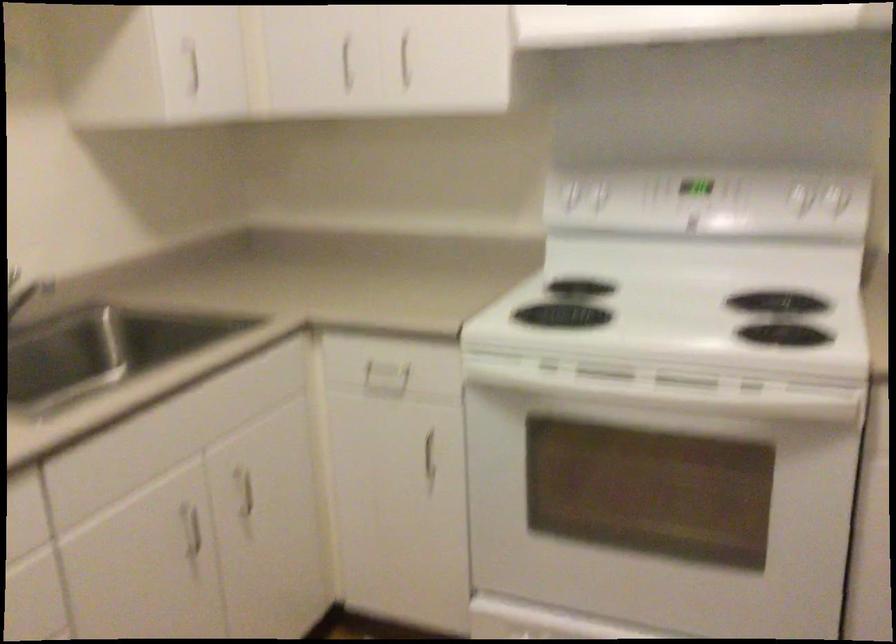
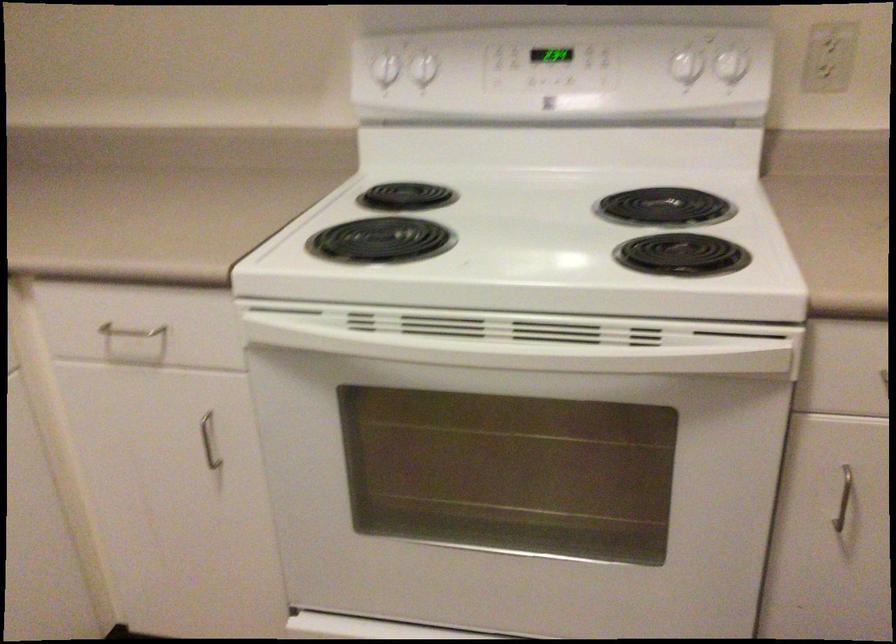
Where in the second image is the point corresponding to (791,333) from the first image?

(682, 254)